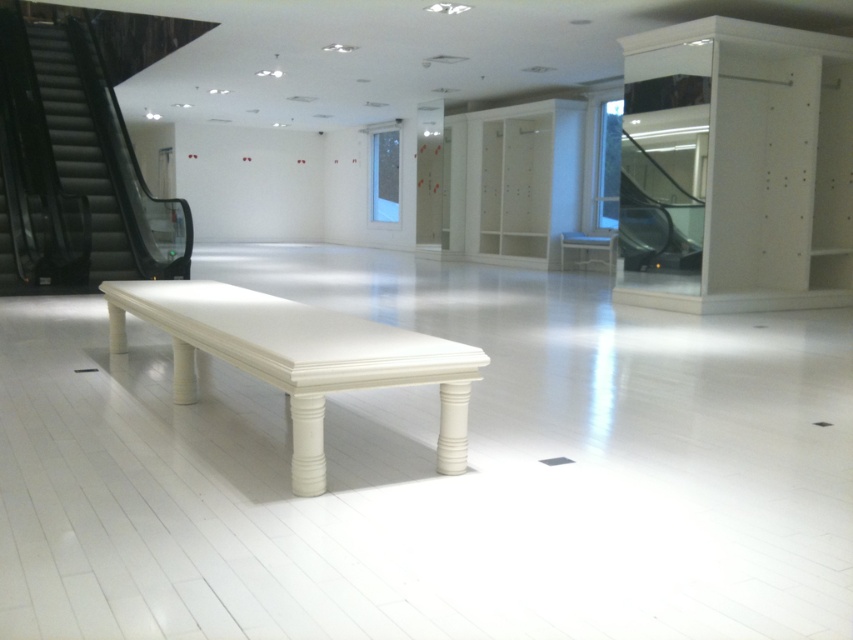
Question: Does black glass escalator at left have a greater width compared to white glossy bench at center?

Choices:
 (A) no
 (B) yes

Answer: (A)

Question: Which object is farther from the camera taking this photo?

Choices:
 (A) white glossy bench at center
 (B) metallic glass escalator at right
 (C) white glossy stool at center
 (D) black glass escalator at left

Answer: (C)

Question: Which object is closer to the camera taking this photo?

Choices:
 (A) black glass escalator at left
 (B) white glossy stool at center

Answer: (A)

Question: Is black glass escalator at left above white glossy bench at center?

Choices:
 (A) no
 (B) yes

Answer: (B)

Question: Among these points, which one is nearest to the camera?

Choices:
 (A) (560, 234)
 (B) (456, 406)
 (C) (672, 221)
 (D) (131, 276)

Answer: (B)

Question: Does black glass escalator at left lie behind white glossy stool at center?

Choices:
 (A) no
 (B) yes

Answer: (A)